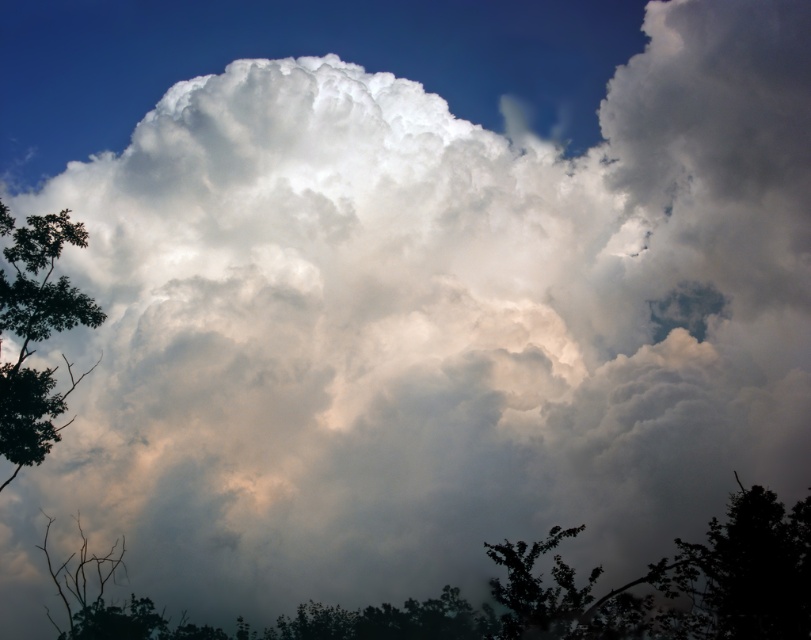
Question: Is green leafy tree at lower center bigger than green leafy tree at left?

Choices:
 (A) no
 (B) yes

Answer: (B)

Question: Among these points, which one is nearest to the camera?

Choices:
 (A) (805, 552)
 (B) (24, 280)

Answer: (A)

Question: Among these points, which one is farthest from the camera?

Choices:
 (A) (329, 609)
 (B) (44, 250)

Answer: (B)

Question: Does green leafy tree at lower center have a larger size compared to green leafy tree at left?

Choices:
 (A) no
 (B) yes

Answer: (B)

Question: Is green leafy tree at lower center bigger than green leafy tree at left?

Choices:
 (A) yes
 (B) no

Answer: (A)